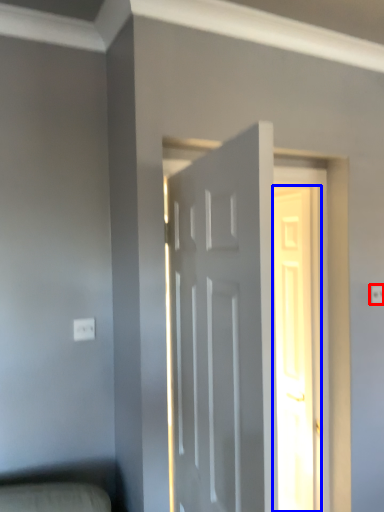
Question: Which object appears farthest to the camera in this image, electric outlet (highlighted by a red box) or door (highlighted by a blue box)?

Choices:
 (A) electric outlet
 (B) door

Answer: (B)